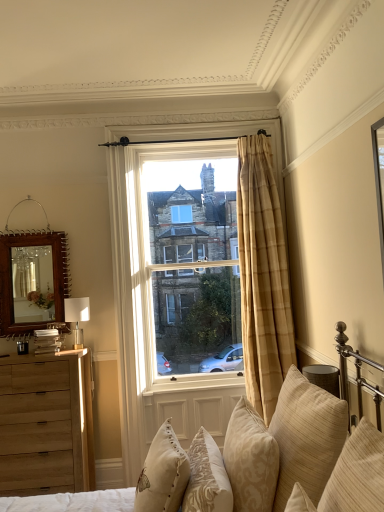
Question: Is the depth of beige embroidered pillow at lower center, which appears as the 5th pillow when viewed from the right, less than that of beige textured pillow at lower right, positioned as the fourth pillow in left-to-right order?

Choices:
 (A) no
 (B) yes

Answer: (A)

Question: From a real-world perspective, is beige embroidered pillow at lower center, which appears as the 5th pillow when viewed from the right, on beige textured pillow at lower right, positioned as the fourth pillow in left-to-right order?

Choices:
 (A) no
 (B) yes

Answer: (A)

Question: Considering the relative positions of beige embroidered pillow at lower center, acting as the first pillow starting from the left, and beige textured pillow at lower right, positioned as the fourth pillow in left-to-right order, in the image provided, is beige embroidered pillow at lower center, acting as the first pillow starting from the left, to the left of beige textured pillow at lower right, positioned as the fourth pillow in left-to-right order, from the viewer's perspective?

Choices:
 (A) yes
 (B) no

Answer: (A)

Question: Considering the relative sizes of beige embroidered pillow at lower center, acting as the first pillow starting from the left, and beige textured pillow at lower right, the second pillow positioned from the right, in the image provided, is beige embroidered pillow at lower center, acting as the first pillow starting from the left, bigger than beige textured pillow at lower right, the second pillow positioned from the right,?

Choices:
 (A) no
 (B) yes

Answer: (A)

Question: Is beige embroidered pillow at lower center, which appears as the 5th pillow when viewed from the right, with beige textured pillow at lower right, the second pillow positioned from the right?

Choices:
 (A) no
 (B) yes

Answer: (A)

Question: Is point (18, 325) closer or farther from the camera than point (339, 400)?

Choices:
 (A) closer
 (B) farther

Answer: (B)

Question: Is wooden mirror at left wider or thinner than beige textured pillow at lower right, positioned as the fourth pillow in left-to-right order?

Choices:
 (A) wide
 (B) thin

Answer: (B)

Question: Do you think wooden mirror at left is within beige textured pillow at lower right, positioned as the fourth pillow in left-to-right order, or outside of it?

Choices:
 (A) inside
 (B) outside

Answer: (B)

Question: In terms of height, does wooden mirror at left look taller or shorter compared to beige textured pillow at lower right, the second pillow positioned from the right?

Choices:
 (A) tall
 (B) short

Answer: (A)

Question: Does point [211, 438] appear closer or farther from the camera than point [322, 391]?

Choices:
 (A) closer
 (B) farther

Answer: (B)

Question: In terms of width, does beige fabric cushions at lower right look wider or thinner when compared to beige textured pillow at lower right, positioned as the fourth pillow in left-to-right order?

Choices:
 (A) wide
 (B) thin

Answer: (A)

Question: Is beige fabric cushions at lower right inside or outside of beige textured pillow at lower right, positioned as the fourth pillow in left-to-right order?

Choices:
 (A) inside
 (B) outside

Answer: (B)

Question: From a real-world perspective, is beige fabric cushions at lower right physically located above or below beige textured pillow at lower right, positioned as the fourth pillow in left-to-right order?

Choices:
 (A) below
 (B) above

Answer: (A)

Question: From a real-world perspective, relative to white fabric lampshade at left, is plaid curtain at center, which appears as the 1th window when viewed from the front, vertically above or below?

Choices:
 (A) below
 (B) above

Answer: (B)

Question: In the image, is plaid curtain at center, which appears as the 1th window when viewed from the front, on the left side or the right side of white fabric lampshade at left?

Choices:
 (A) left
 (B) right

Answer: (B)